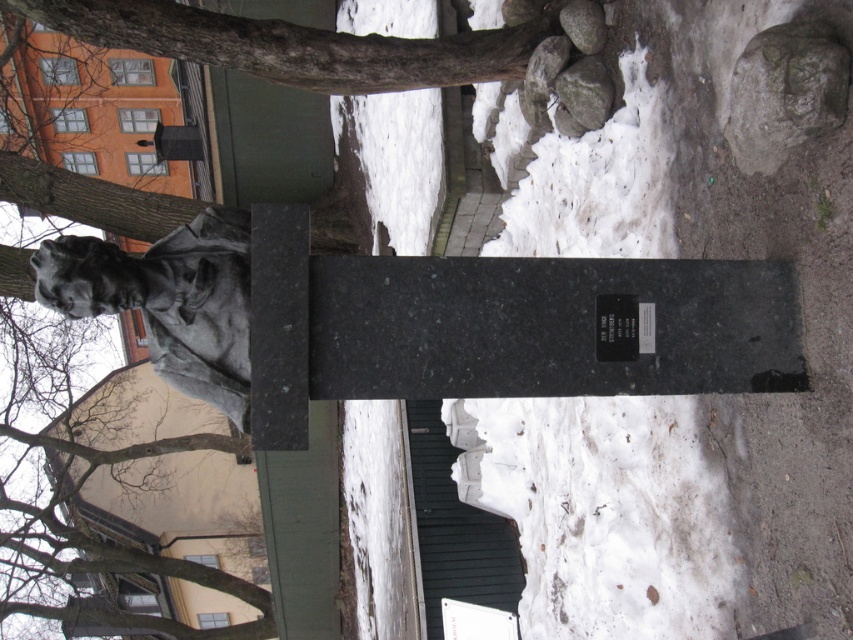
You are standing in the winter scene and want to take a photo of the statue. You notice two points marked in the image. The first point is at coordinates point (x=212, y=76) and the second point is at point (x=776, y=77). Which point is closer to you when you are facing the statue?

Point (x=212, y=76) is further to the camera than point (x=776, y=77), so the second point is closer to you.

You are standing in the winter scene and want to take a photo of the statue. To avoid having the brown rough bark at upper center in your photo, where should you position yourself relative to the statue?

The brown rough bark at upper center is located at point [296,49] in the image. To avoid it in your photo, position yourself to the right of the statue so the bark is out of frame.

You are a park maintenance worker who needs to place a 3.05 meter long snow removal tool between the brown rough bark at upper center and the smooth gray rock at upper right. Can you fit the tool horizontally between them without bending it?

The brown rough bark at upper center and smooth gray rock at upper right are 3.04 meters apart, so the 3.05 meter long tool is slightly too long to fit horizontally between them without bending it.